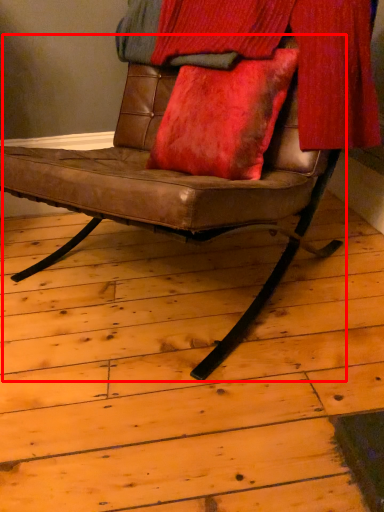
Question: Considering the relative positions of chair (annotated by the red box) and curtain in the image provided, where is chair (annotated by the red box) located with respect to the staircase?

Choices:
 (A) left
 (B) right

Answer: (A)